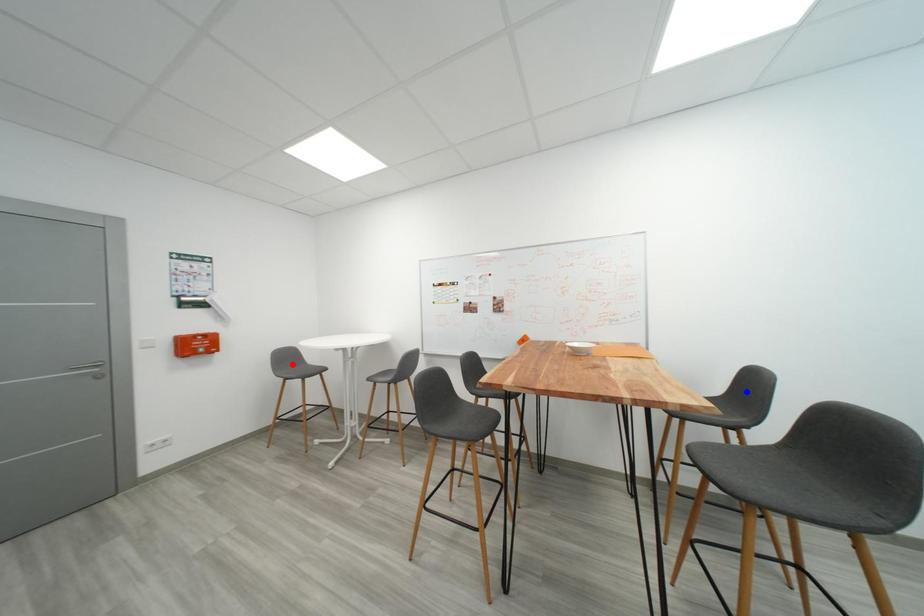
Question: Which of the two points in the image is closer to the camera?

Choices:
 (A) Blue point is closer.
 (B) Red point is closer.

Answer: (A)